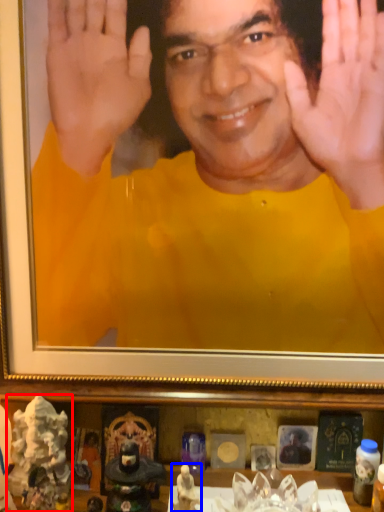
Question: Which object is further to the camera taking this photo, toy (highlighted by a red box) or toy (highlighted by a blue box)?

Choices:
 (A) toy
 (B) toy

Answer: (A)